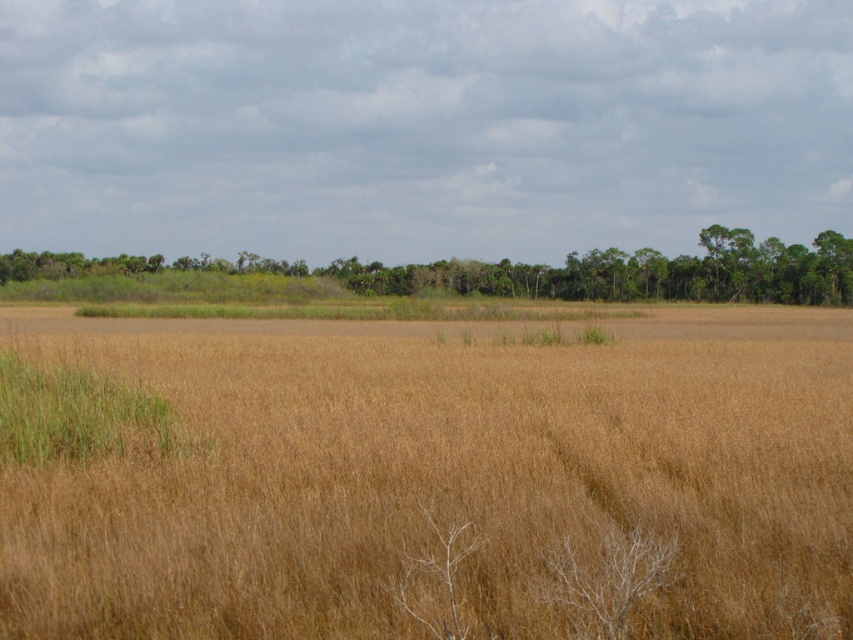
Between point (97, 324) and point (816, 268), which one is positioned in front?

Point (97, 324)

Who is taller, brown grassland at center or green leafy trees at center?

green leafy trees at center

Between point (178, 582) and point (413, 275), which one is positioned behind?

The point (413, 275) is more distant.

Where is `brown grassland at center`? brown grassland at center is located at coordinates (426, 476).